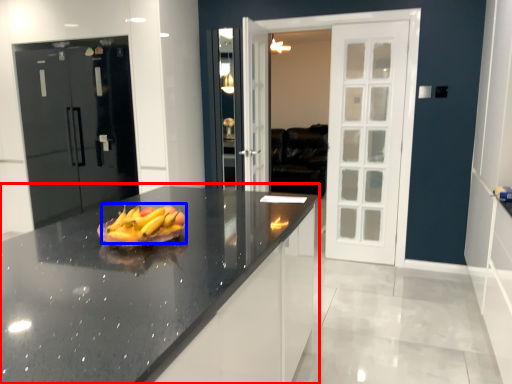
Question: Which object appears closest to the camera in this image, countertop (highlighted by a red box) or grapefruit (highlighted by a blue box)?

Choices:
 (A) countertop
 (B) grapefruit

Answer: (A)